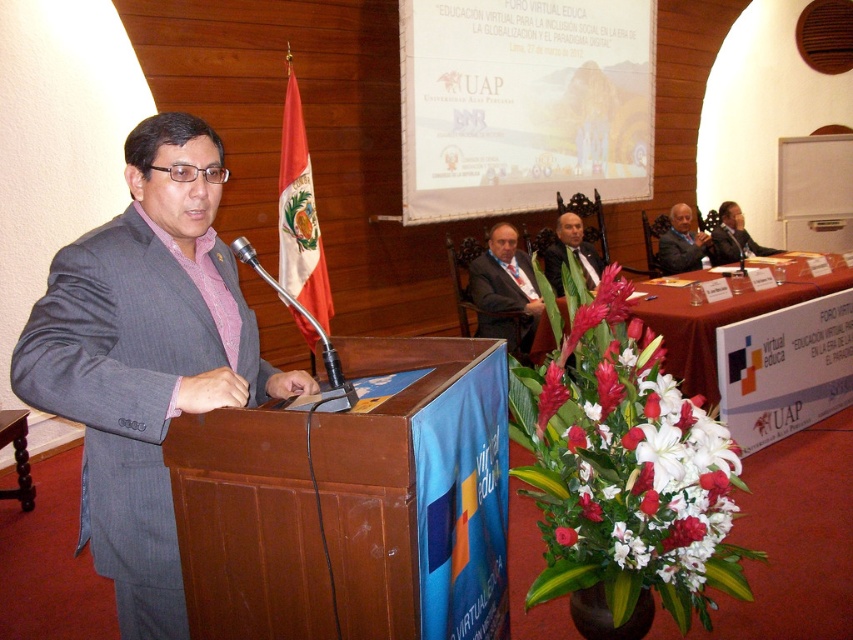
Question: Which point appears closest to the camera in this image?

Choices:
 (A) (555, 241)
 (B) (544, 369)

Answer: (B)

Question: Which object is closer to the camera taking this photo?

Choices:
 (A) gray pinstripe suit at left
 (B) white matte flower at center
 (C) metallic silver microphone at center
 (D) white glossy flowers at center

Answer: (A)

Question: Among these objects, which one is nearest to the camera?

Choices:
 (A) metallic silver microphone at center
 (B) gray suit at center

Answer: (A)

Question: Does gray suit at center have a lesser width compared to matte pink flower at center?

Choices:
 (A) no
 (B) yes

Answer: (A)

Question: Can you confirm if smooth black suit at right is positioned below matte pink flower at center?

Choices:
 (A) no
 (B) yes

Answer: (A)

Question: Can you confirm if white glossy flowers at center is positioned above gray fabric suit at center?

Choices:
 (A) no
 (B) yes

Answer: (A)